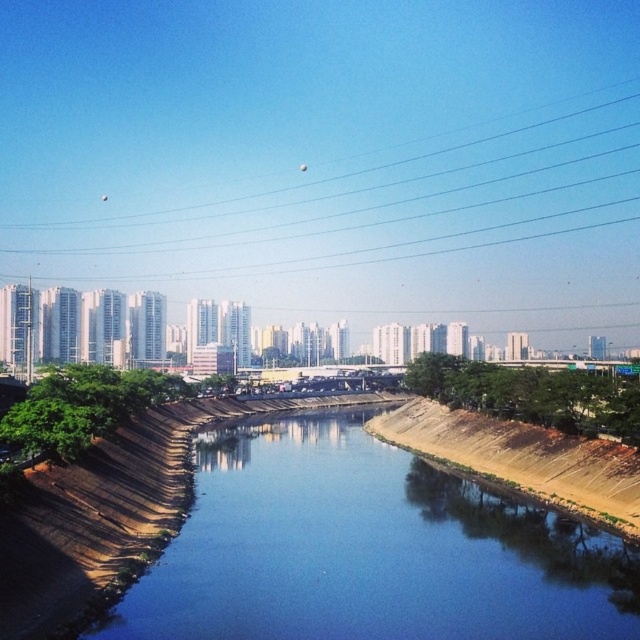
You are a bird flying over the urban landscape. You see the blue smooth water at center and the transparent glass power lines at upper center. Which object is lower in the scene?

The blue smooth water at center is lower than the transparent glass power lines at upper center.